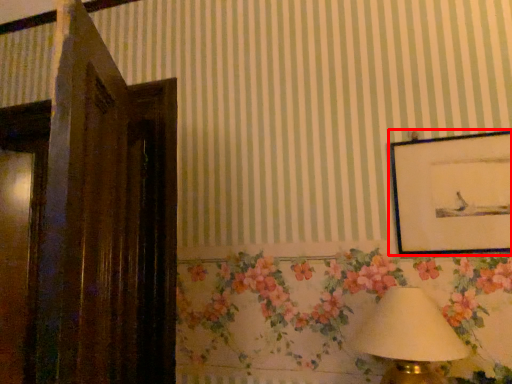
Question: From the image's perspective, what is the correct spatial positioning of picture frame (annotated by the red box) in reference to table lamp?

Choices:
 (A) above
 (B) below

Answer: (A)